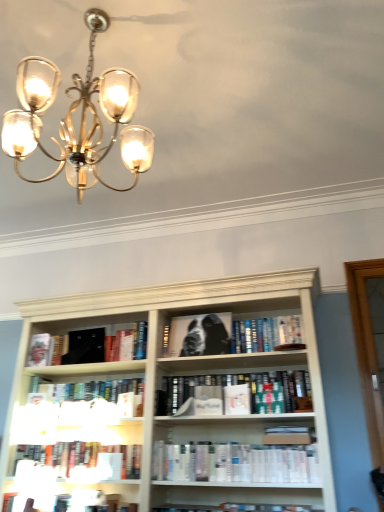
Find the location of a particular element. The image size is (384, 512). empty space that is ontop of matte gold chandelier at upper left (from a real-world perspective) is located at coordinates (101, 30).